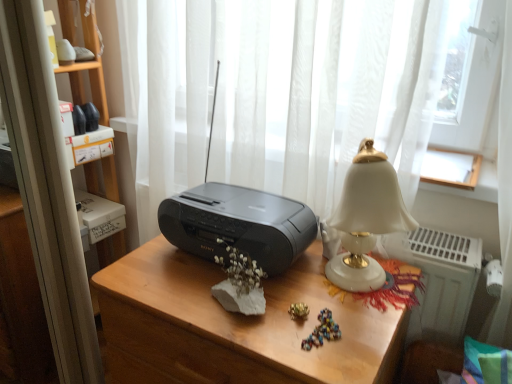
Question: Is black plastic stereo at center oriented away from matte black radio at center?

Choices:
 (A) no
 (B) yes

Answer: (A)

Question: Is black plastic stereo at center oriented towards matte black radio at center?

Choices:
 (A) yes
 (B) no

Answer: (B)

Question: Considering the relative sizes of black plastic stereo at center and matte black radio at center in the image provided, is black plastic stereo at center shorter than matte black radio at center?

Choices:
 (A) yes
 (B) no

Answer: (A)

Question: Is the depth of black plastic stereo at center less than that of matte black radio at center?

Choices:
 (A) yes
 (B) no

Answer: (B)

Question: From a real-world perspective, is black plastic stereo at center positioned over matte black radio at center based on gravity?

Choices:
 (A) no
 (B) yes

Answer: (B)

Question: Is black plastic stereo at center at the right side of matte black radio at center?

Choices:
 (A) yes
 (B) no

Answer: (B)

Question: Does white sheer curtain at center have a larger size compared to white porcelain lamp at right?

Choices:
 (A) yes
 (B) no

Answer: (A)

Question: Are white sheer curtain at center and white porcelain lamp at right beside each other?

Choices:
 (A) yes
 (B) no

Answer: (B)

Question: Considering the relative sizes of white sheer curtain at center and white porcelain lamp at right in the image provided, is white sheer curtain at center taller than white porcelain lamp at right?

Choices:
 (A) yes
 (B) no

Answer: (A)

Question: From a real-world perspective, is white sheer curtain at center positioned under white porcelain lamp at right based on gravity?

Choices:
 (A) no
 (B) yes

Answer: (B)

Question: Could you tell me if white sheer curtain at center is facing white porcelain lamp at right?

Choices:
 (A) yes
 (B) no

Answer: (A)

Question: Is white sheer curtain at center far from white porcelain lamp at right?

Choices:
 (A) no
 (B) yes

Answer: (A)

Question: Is white porcelain lamp at right completely or partially outside of black plastic stereo at center?

Choices:
 (A) no
 (B) yes

Answer: (B)